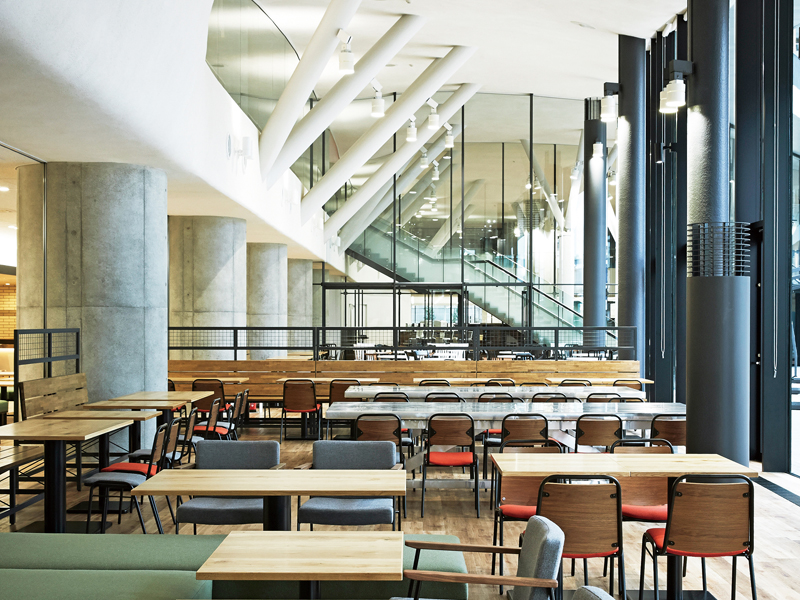
Find the location of `red seats on chairs`. red seats on chairs is located at coordinates (134, 467), (214, 430), (300, 412), (446, 460), (492, 433), (514, 514), (637, 513), (594, 556), (662, 535).